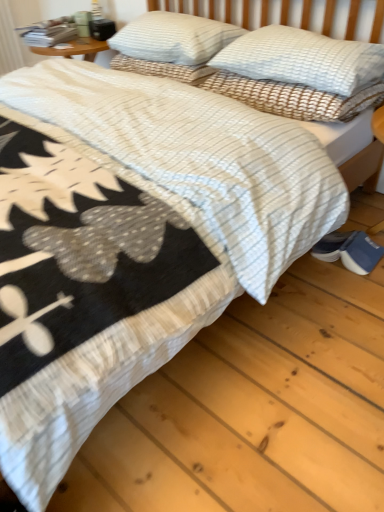
What are the coordinates of `blue suede shoes at lower right` in the screenshot? It's located at (349, 250).

Is the depth of white textured pillow at upper center, the first pillow in the left-to-right sequence, greater than that of blue suede shoes at lower right?

Yes, white textured pillow at upper center, the first pillow in the left-to-right sequence, is further from the viewer.

Is white textured pillow at upper center, the first pillow in the left-to-right sequence, shorter than blue suede shoes at lower right?

No.

Which object is thinner, white textured pillow at upper center, the 3th pillow from the right, or blue suede shoes at lower right?

With smaller width is blue suede shoes at lower right.

Which point is more distant from viewer, (143, 15) or (342, 247)?

The point (143, 15) is farther.

Can blue suede shoes at lower right be found inside white textured pillow at upper center, placed as the 3th pillow when sorted from left to right?

No, blue suede shoes at lower right is not surrounded by white textured pillow at upper center, placed as the 3th pillow when sorted from left to right.

Considering the positions of point (249, 61) and point (361, 262), is point (249, 61) closer or farther from the camera than point (361, 262)?

Point (249, 61) appears to be farther away from the viewer than point (361, 262).

Which is behind, white textured pillow at upper center, the 3th pillow from the right, or white textured pillow at upper center, placed as the 3th pillow when sorted from left to right?

white textured pillow at upper center, the 3th pillow from the right, is further away from the camera.

Based on the photo, from the image's perspective, which object appears higher, white textured pillow at upper center, the 3th pillow from the right, or white textured pillow at upper center, placed as the 3th pillow when sorted from left to right?

white textured pillow at upper center, the 3th pillow from the right.

Are white textured pillow at upper center, the first pillow in the left-to-right sequence, and white textured pillow at upper center, placed as the 3th pillow when sorted from left to right, far apart?

That's not correct — white textured pillow at upper center, the first pillow in the left-to-right sequence, is a little close to white textured pillow at upper center, placed as the 3th pillow when sorted from left to right.

Between white textured pillow at upper center, the 3th pillow from the right, and white textured pillow at upper center, placed as the 3th pillow when sorted from left to right, which one has larger width?

white textured pillow at upper center, the 3th pillow from the right, is wider.

Which is in front, point (306, 33) or point (194, 55)?

Positioned in front is point (306, 33).

Where is `pillow located above the white textured pillow at upper center, placed as the 3th pillow when sorted from left to right (from the image's perspective)`? The image size is (384, 512). pillow located above the white textured pillow at upper center, placed as the 3th pillow when sorted from left to right (from the image's perspective) is located at coordinates (174, 38).

Which of these two, white textured pillow at upper center, the first pillow from the right, or white textured pillow at upper center, the first pillow in the left-to-right sequence, is smaller?

Smaller between the two is white textured pillow at upper center, the first pillow from the right.

Is white textured pillow at upper center, the first pillow from the right, inside or outside of white textured pillow at upper center, the first pillow in the left-to-right sequence?

white textured pillow at upper center, the first pillow from the right, is located beyond the bounds of white textured pillow at upper center, the first pillow in the left-to-right sequence.

Considering the relative sizes of white textured pillow at upper right, the second pillow positioned from the left, and blue suede shoes at lower right in the image provided, is white textured pillow at upper right, the second pillow positioned from the left, taller than blue suede shoes at lower right?

Yes.

Is white textured pillow at upper right, placed as the second pillow when sorted from right to left, surrounding blue suede shoes at lower right?

No, blue suede shoes at lower right is not a part of white textured pillow at upper right, placed as the second pillow when sorted from right to left.

Which is nearer, (243, 97) or (375, 260)?

Answer: The point (375, 260) is more forward.

The image size is (384, 512). I want to click on footwear lying below the white textured pillow at upper right, placed as the second pillow when sorted from right to left (from the image's perspective), so click(349, 250).

Is white textured pillow at upper center, placed as the 3th pillow when sorted from left to right, bigger than white textured pillow at upper right, the second pillow positioned from the left?

Yes, white textured pillow at upper center, placed as the 3th pillow when sorted from left to right, is bigger than white textured pillow at upper right, the second pillow positioned from the left.

Does white textured pillow at upper center, the first pillow from the right, appear on the right side of white textured pillow at upper right, placed as the second pillow when sorted from right to left?

Correct, you'll find white textured pillow at upper center, the first pillow from the right, to the right of white textured pillow at upper right, placed as the second pillow when sorted from right to left.

Is white textured pillow at upper center, placed as the 3th pillow when sorted from left to right, facing away from white textured pillow at upper right, the second pillow positioned from the left?

No, white textured pillow at upper right, the second pillow positioned from the left, is not at the back of white textured pillow at upper center, placed as the 3th pillow when sorted from left to right.

Is white textured pillow at upper center, the first pillow from the right, situated inside white textured pillow at upper right, the second pillow positioned from the left, or outside?

white textured pillow at upper center, the first pillow from the right, lies outside white textured pillow at upper right, the second pillow positioned from the left.

Is white textured pillow at upper right, the second pillow positioned from the left, oriented towards white textured pillow at upper center, the 3th pillow from the right?

No, white textured pillow at upper right, the second pillow positioned from the left, does not turn towards white textured pillow at upper center, the 3th pillow from the right.

How different are the orientations of white textured pillow at upper right, the second pillow positioned from the left, and white textured pillow at upper center, the 3th pillow from the right, in degrees?

There is a 0.000779-degree angle between the facing directions of white textured pillow at upper right, the second pillow positioned from the left, and white textured pillow at upper center, the 3th pillow from the right.

Does white textured pillow at upper right, the second pillow positioned from the left, contain white textured pillow at upper center, the first pillow in the left-to-right sequence?

No.

Between point (241, 100) and point (186, 26), which one is positioned behind?

The point (186, 26) is farther from the camera.

There is a blue suede shoes at lower right. What are the coordinates of `the 3rd pillow above it (from the image's perspective)` in the screenshot? It's located at (174, 38).

Where is `the 2nd pillow in front when counting from the blue suede shoes at lower right`? the 2nd pillow in front when counting from the blue suede shoes at lower right is located at coordinates (303, 59).

Considering their positions, is white textured pillow at upper right, the second pillow positioned from the left, positioned closer to blue suede shoes at lower right than white textured pillow at upper center, the first pillow in the left-to-right sequence?

The object closer to blue suede shoes at lower right is white textured pillow at upper right, the second pillow positioned from the left.

From the image, which object appears to be farther from white textured pillow at upper center, the first pillow in the left-to-right sequence, blue suede shoes at lower right or white textured pillow at upper center, the first pillow from the right?

Based on the image, blue suede shoes at lower right appears to be further to white textured pillow at upper center, the first pillow in the left-to-right sequence.

Looking at the image, which one is located further to white textured pillow at upper center, the first pillow from the right, blue suede shoes at lower right or white textured pillow at upper center, the 3th pillow from the right?

Based on the image, blue suede shoes at lower right appears to be further to white textured pillow at upper center, the first pillow from the right.

Looking at the image, which one is located further to white textured pillow at upper center, placed as the 3th pillow when sorted from left to right, white textured pillow at upper center, the first pillow in the left-to-right sequence, or white textured pillow at upper right, the second pillow positioned from the left?

white textured pillow at upper center, the first pillow in the left-to-right sequence, is further to white textured pillow at upper center, placed as the 3th pillow when sorted from left to right.

Considering their positions, is blue suede shoes at lower right positioned further to white textured pillow at upper right, placed as the second pillow when sorted from right to left, than white textured pillow at upper center, the first pillow from the right?

Among the two, blue suede shoes at lower right is located further to white textured pillow at upper right, placed as the second pillow when sorted from right to left.

Considering their positions, is white textured pillow at upper right, the second pillow positioned from the left, positioned closer to blue suede shoes at lower right than white textured pillow at upper center, placed as the 3th pillow when sorted from left to right?

white textured pillow at upper right, the second pillow positioned from the left, is closer to blue suede shoes at lower right.

Which object lies further to the anchor point white textured pillow at upper center, placed as the 3th pillow when sorted from left to right, white textured pillow at upper center, the 3th pillow from the right, or blue suede shoes at lower right?

Among the two, blue suede shoes at lower right is located further to white textured pillow at upper center, placed as the 3th pillow when sorted from left to right.

Estimate the real-world distances between objects in this image. Which object is closer to white textured pillow at upper center, the first pillow from the right, white textured pillow at upper right, the second pillow positioned from the left, or blue suede shoes at lower right?

white textured pillow at upper right, the second pillow positioned from the left, is positioned closer to the anchor white textured pillow at upper center, the first pillow from the right.

Identify the location of pillow between white textured pillow at upper center, the first pillow from the right, and blue suede shoes at lower right from top to bottom. The width and height of the screenshot is (384, 512). (292, 97).

Identify the location of pillow between white textured pillow at upper center, the 3th pillow from the right, and white textured pillow at upper center, placed as the 3th pillow when sorted from left to right. The image size is (384, 512). (292, 97).